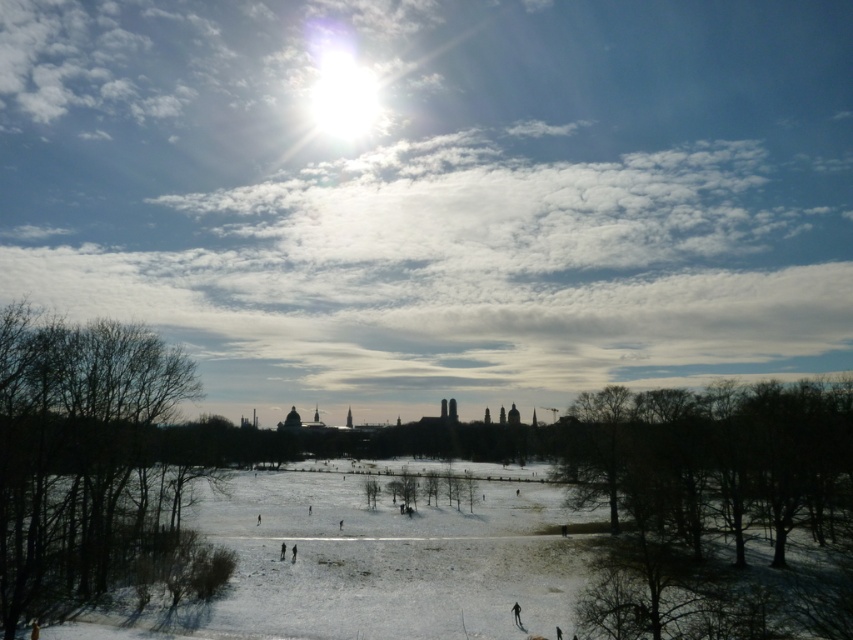
Question: Does brown leafless tree at lower right appear over bare branches at left?

Choices:
 (A) no
 (B) yes

Answer: (A)

Question: Which object appears farthest from the camera in this image?

Choices:
 (A) bare branches at left
 (B) brown leafless tree at lower right

Answer: (B)

Question: Among these objects, which one is farthest from the camera?

Choices:
 (A) bright white clouds at upper center
 (B) brown leafless tree at lower right
 (C) bare branches at left

Answer: (A)

Question: Where is bright white clouds at upper center located in relation to brown leafless tree at lower right in the image?

Choices:
 (A) right
 (B) left

Answer: (B)

Question: Which object appears farthest from the camera in this image?

Choices:
 (A) bright white clouds at upper center
 (B) bare branches at left
 (C) brown leafless tree at lower right

Answer: (A)

Question: Does bright white clouds at upper center appear over bare branches at left?

Choices:
 (A) yes
 (B) no

Answer: (A)